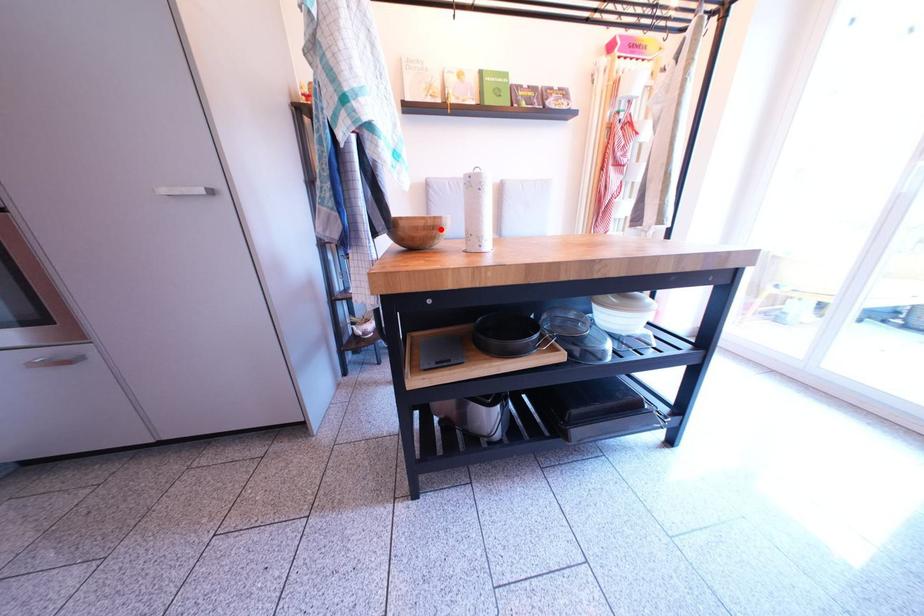
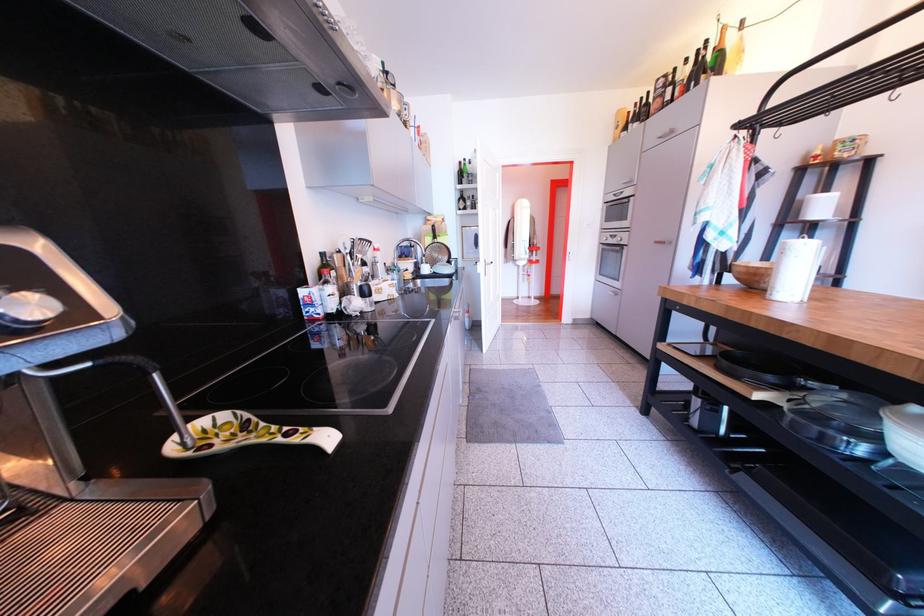
Locate, in the second image, the point that corresponds to the highlighted location in the first image.

(762, 277)